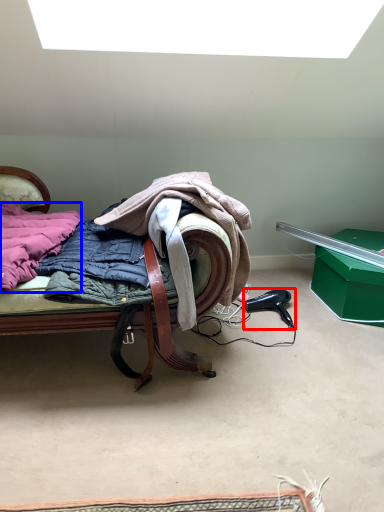
Question: Among these objects, which one is nearest to the camera, hair drier (highlighted by a red box) or underclothes (highlighted by a blue box)?

Choices:
 (A) hair drier
 (B) underclothes

Answer: (B)